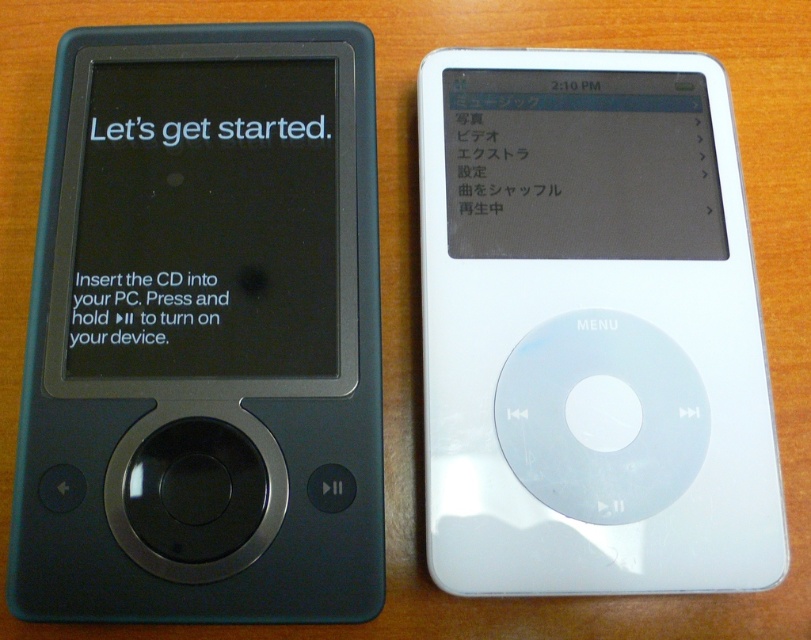
Question: Which of these objects is positioned closest to the matte black ipod at left?

Choices:
 (A) white glossy ipod at right
 (B) matte black screen at left
 (C) matte black screen at upper right

Answer: (B)

Question: Is matte black ipod at left further to camera compared to matte black screen at left?

Choices:
 (A) no
 (B) yes

Answer: (A)

Question: Estimate the real-world distances between objects in this image. Which object is farther from the matte black screen at upper right?

Choices:
 (A) matte black screen at left
 (B) white glossy ipod at right
 (C) matte black ipod at left

Answer: (A)

Question: From the image, what is the correct spatial relationship of matte black ipod at left in relation to matte black screen at upper right?

Choices:
 (A) above
 (B) below

Answer: (B)

Question: Does white glossy ipod at right appear on the left side of matte black screen at left?

Choices:
 (A) yes
 (B) no

Answer: (B)

Question: Among these objects, which one is farthest from the camera?

Choices:
 (A) matte black ipod at left
 (B) matte black screen at left
 (C) matte black screen at upper right
 (D) white glossy ipod at right

Answer: (C)